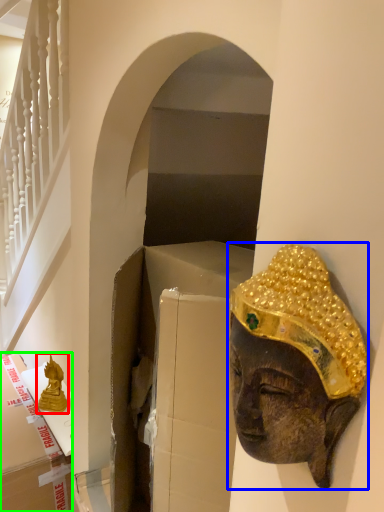
Question: Estimate the real-world distances between objects in this image. Which object is farther from statue (highlighted by a red box), person (highlighted by a blue box) or cardboard box (highlighted by a green box)?

Choices:
 (A) person
 (B) cardboard box

Answer: (A)